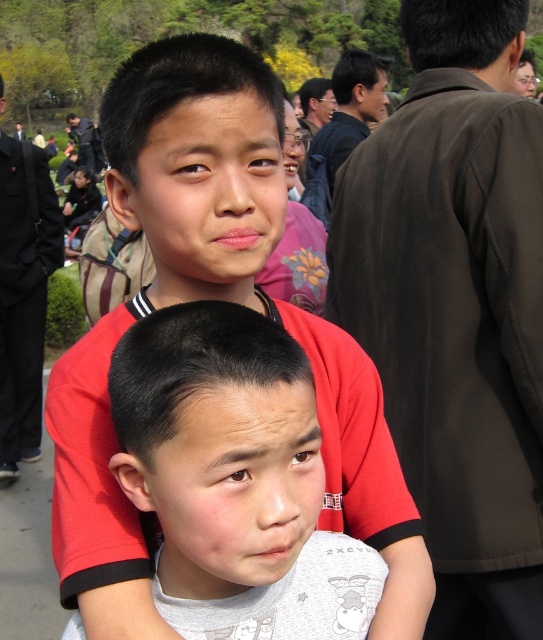
You are a photographer trying to capture a candid shot of the matte red shirt at center without including the brown fabric shoulder at upper right in the frame. Based on their positions, is this possible?

The matte red shirt at center is behind the brown fabric shoulder at upper right, so it would be blocked from view. Therefore, capturing the matte red shirt at center without the brown fabric shoulder at upper right in the frame is not possible.

You are a photographer trying to capture a candid shot of both the brown fabric shoulder at upper right and the gray cotton shirt at center in the image. Given their sizes, which object should you adjust your camera focus to prioritize to ensure both are in frame without zooming in?

The brown fabric shoulder at upper right is wider than the gray cotton shirt at center, so you should adjust your camera focus to prioritize the brown fabric shoulder at upper right to ensure both are in frame without zooming in.

You are standing in a park and see a point at coordinates (457,307). What object does this point correspond to?

The point at coordinates (457,307) corresponds to the brown fabric shoulder at upper right.